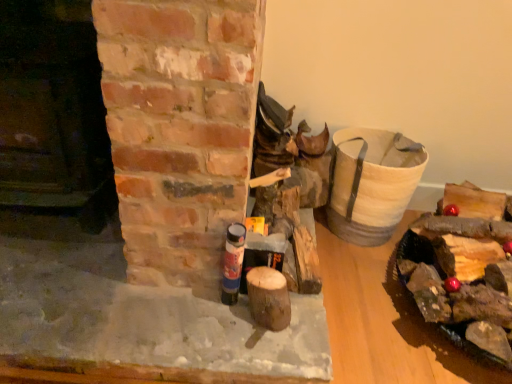
You are a GUI agent. You are given a task and a screenshot of the screen. Output one action in this format:
    pyautogui.click(x=<x>, y=<y>)
    Task: Click on the vacant area that lies in front of blue matte spray can at center
    The height and width of the screenshot is (384, 512).
    Given the screenshot: What is the action you would take?
    pyautogui.click(x=224, y=348)